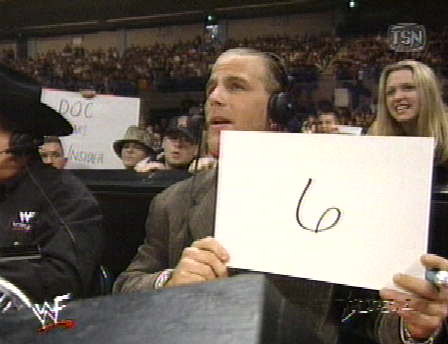
The height and width of the screenshot is (344, 448). In order to click on bucket in this screenshot , I will do click(133, 133).